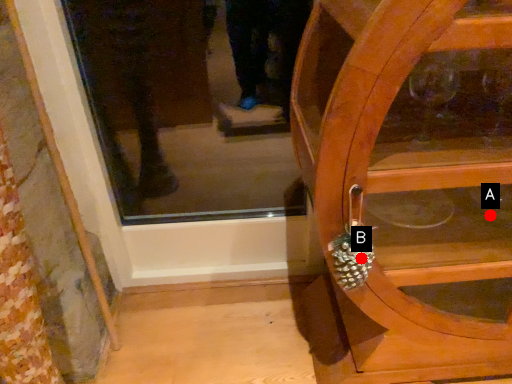
Question: Two points are circled on the image, labeled by A and B beside each circle. Which point is farther from the camera taking this photo?

Choices:
 (A) A is further
 (B) B is further

Answer: (A)